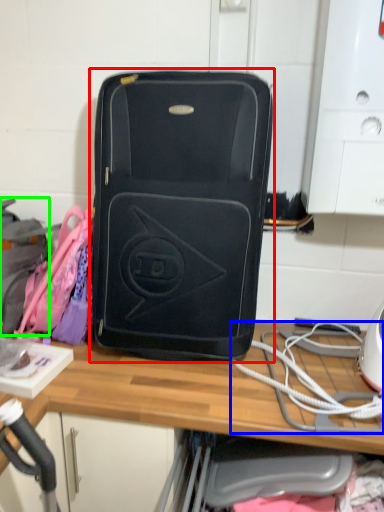
Question: Which object is the closest to the luggage and bags (highlighted by a red box)? Choose among these: rope (highlighted by a blue box) or luggage (highlighted by a green box).

Choices:
 (A) rope
 (B) luggage

Answer: (A)